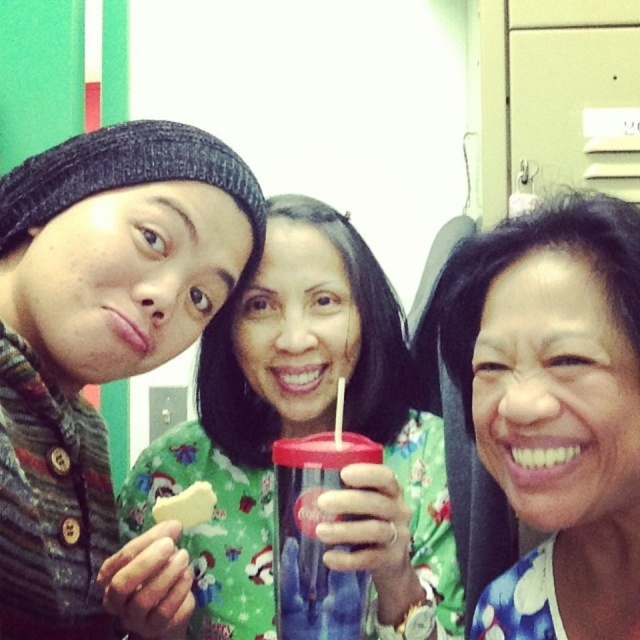
Question: Which object is the closest to the green fabric shirt at center?

Choices:
 (A) translucent plastic cup at center
 (B) floral fabric shirt at center

Answer: (A)

Question: Among these objects, which one is farthest from the camera?

Choices:
 (A) translucent plastic cup at center
 (B) floral fabric shirt at center

Answer: (A)

Question: Does green fabric shirt at center have a greater width compared to translucent plastic cup at center?

Choices:
 (A) no
 (B) yes

Answer: (B)

Question: Observing the image, what is the correct spatial positioning of green fabric shirt at center in reference to matte black beanie at upper left?

Choices:
 (A) below
 (B) above

Answer: (A)

Question: Is translucent plastic cup at center positioned in front of white crumbly cookie at lower left?

Choices:
 (A) no
 (B) yes

Answer: (B)

Question: Which of the following is the farthest from the observer?

Choices:
 (A) translucent plastic cup at center
 (B) white crumbly cookie at lower left
 (C) matte black beanie at upper left

Answer: (B)